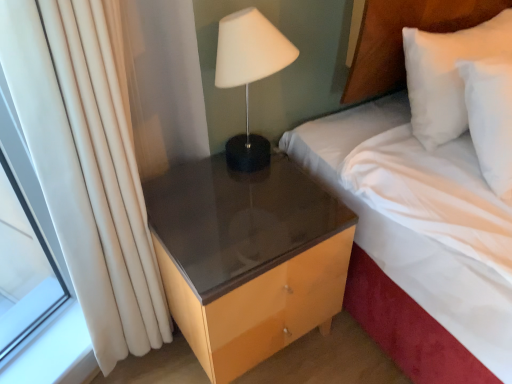
The image size is (512, 384). What are the coordinates of `vacant space in white matte lamp at upper right (from a real-world perspective)` in the screenshot? It's located at (255, 167).